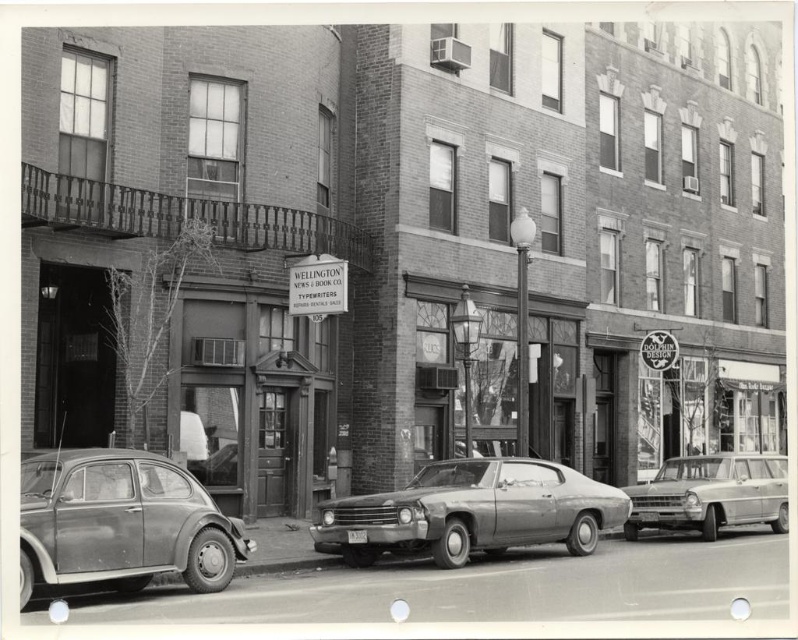
You are a delivery person trying to park your metallic gray sedan at center in this street. The parking spot you want is located at coordinates point 0.802, 0.591. Can you park your car there?

The metallic gray sedan at center is already positioned at point (x=471, y=513), so the parking spot is already occupied by the metallic gray sedan at center.

You are standing at the intersection looking at the street. There is a point marked at coordinate point [471,513]. What object is located at that point?

The metallic gray sedan at center is located at point [471,513].